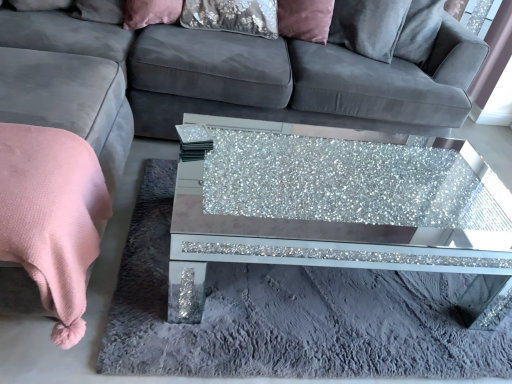
Question: Could you tell me if velvet pink pillow at upper center is facing glittery mirrored coffee table at center?

Choices:
 (A) no
 (B) yes

Answer: (A)

Question: Can you confirm if velvet pink pillow at upper center is smaller than glittery mirrored coffee table at center?

Choices:
 (A) yes
 (B) no

Answer: (A)

Question: Can you confirm if velvet pink pillow at upper center is shorter than glittery mirrored coffee table at center?

Choices:
 (A) no
 (B) yes

Answer: (B)

Question: Considering the relative positions of velvet pink pillow at upper center and glittery mirrored coffee table at center in the image provided, is velvet pink pillow at upper center behind glittery mirrored coffee table at center?

Choices:
 (A) yes
 (B) no

Answer: (A)

Question: From the image's perspective, is velvet pink pillow at upper center located above glittery mirrored coffee table at center?

Choices:
 (A) no
 (B) yes

Answer: (B)

Question: Is velvet pink pillow at upper center wider than glittery mirrored coffee table at center?

Choices:
 (A) yes
 (B) no

Answer: (B)

Question: Can you confirm if velvet fabric couch at center is bigger than pink soft blanket at lower left?

Choices:
 (A) no
 (B) yes

Answer: (B)

Question: Would you say velvet fabric couch at center is a long distance from pink soft blanket at lower left?

Choices:
 (A) yes
 (B) no

Answer: (B)

Question: Is pink soft blanket at lower left a part of velvet fabric couch at center?

Choices:
 (A) no
 (B) yes

Answer: (A)

Question: Is velvet fabric couch at center to the left of pink soft blanket at lower left from the viewer's perspective?

Choices:
 (A) yes
 (B) no

Answer: (B)

Question: Is velvet fabric couch at center to the right of pink soft blanket at lower left from the viewer's perspective?

Choices:
 (A) yes
 (B) no

Answer: (A)

Question: Can you confirm if velvet fabric couch at center is shorter than pink soft blanket at lower left?

Choices:
 (A) yes
 (B) no

Answer: (B)

Question: Is velvet pink pillow at upper center not within pink soft blanket at lower left?

Choices:
 (A) yes
 (B) no

Answer: (A)